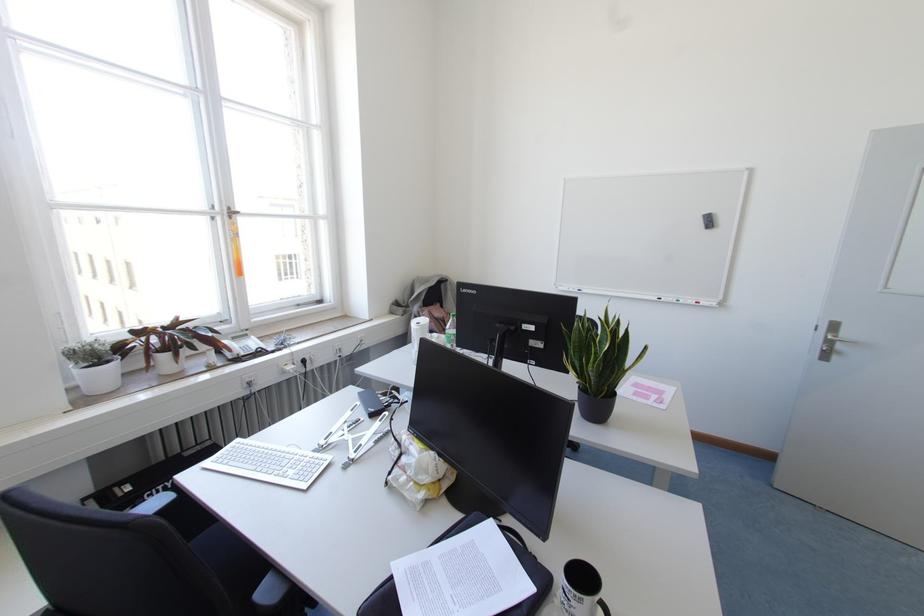
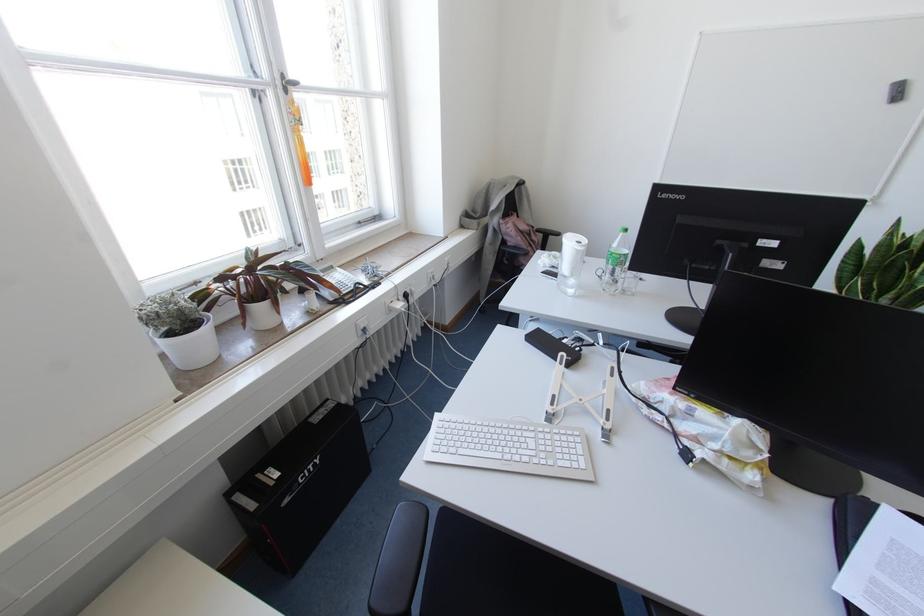
In the second image, find the point that corresponds to [331,432] in the first image.

(553, 395)